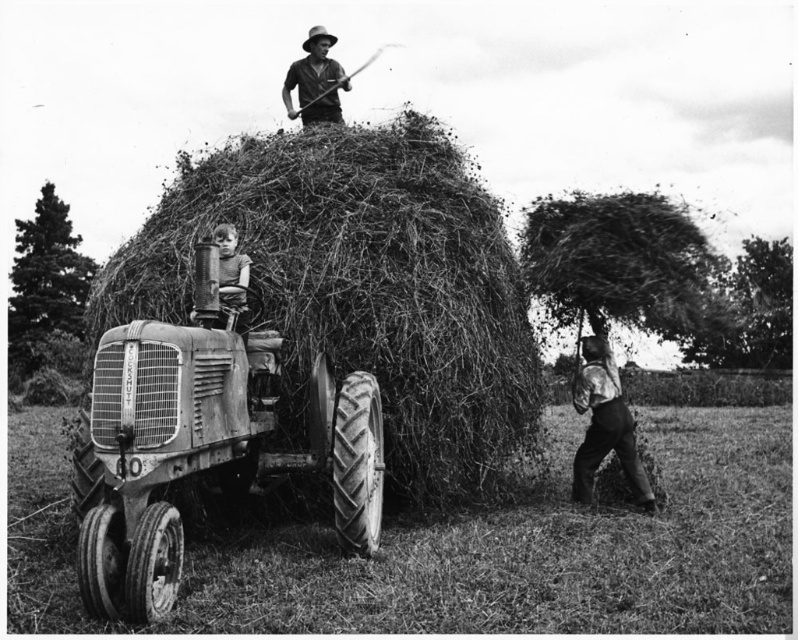
You are a farmer who needs to reach a smooth wooden stick quickly. Which one is closer to you between the smooth wooden stick at upper center and the smooth wooden stick at center?

The smooth wooden stick at upper center is closer to you because it is further to the viewer than the smooth wooden stick at center.

You are a farmer who needs to move a smooth wooden stick at center to the barn. The coarse straw bale at center is blocking the path. Can you lift the stick over the straw bale without touching it?

The distance between the coarse straw bale at center and the smooth wooden stick at center is 1.58 meters. Since the stick is only 1.58 meters away, you can lift it over the straw bale without touching it as the distance allows enough space for maneuvering.